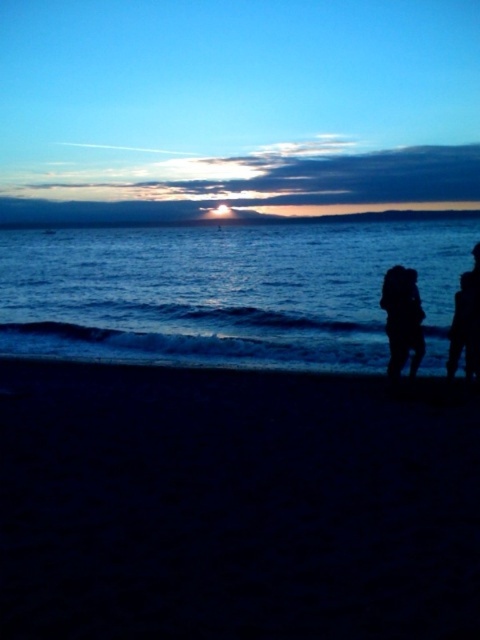
You are standing on the beach and looking at the two points marked in the scene. Which point is closer to you, point (416, 355) or point (403, 273)?

Point (416, 355) is closer to you because it is further to the viewer than point (403, 273).

You are standing on the beach looking at the sunset. There are two points marked in the image. The first point is at coordinates point (56, 621) and the second is at point (451, 360). Which point is closer to you?

Point (56, 621) is closer to the camera than point (451, 360), so the first point is closer to you.

You are a photographer trying to capture the sunset. You notice two figures in the distance on the beach. The silhouette couple at right and the silhouette figure at right. Which one do you think would block the view of the sun if they stood between you and the horizon?

The silhouette couple at right might be wider than the silhouette figure at right, so the silhouette couple at right could potentially block more of the sun or the horizon view compared to the silhouette figure at right.